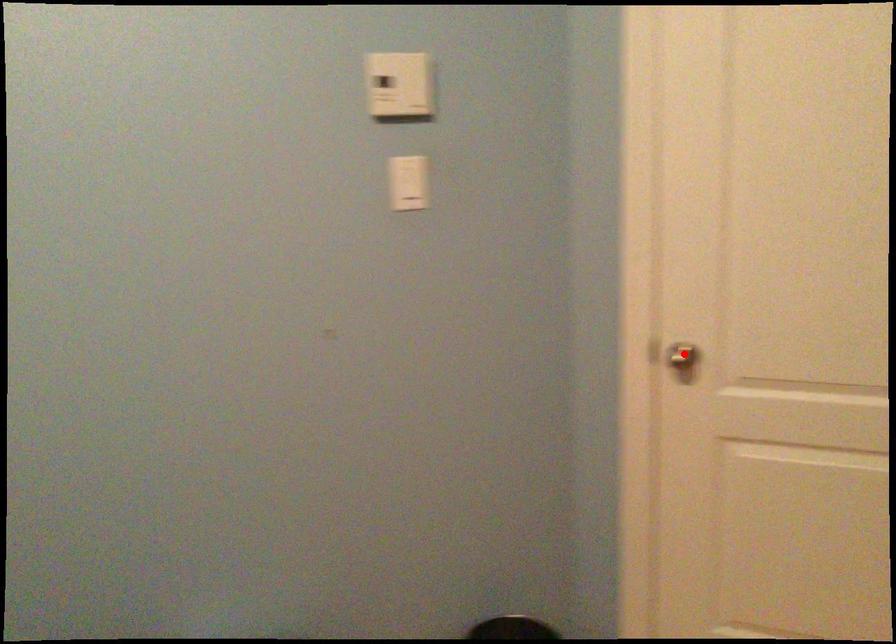
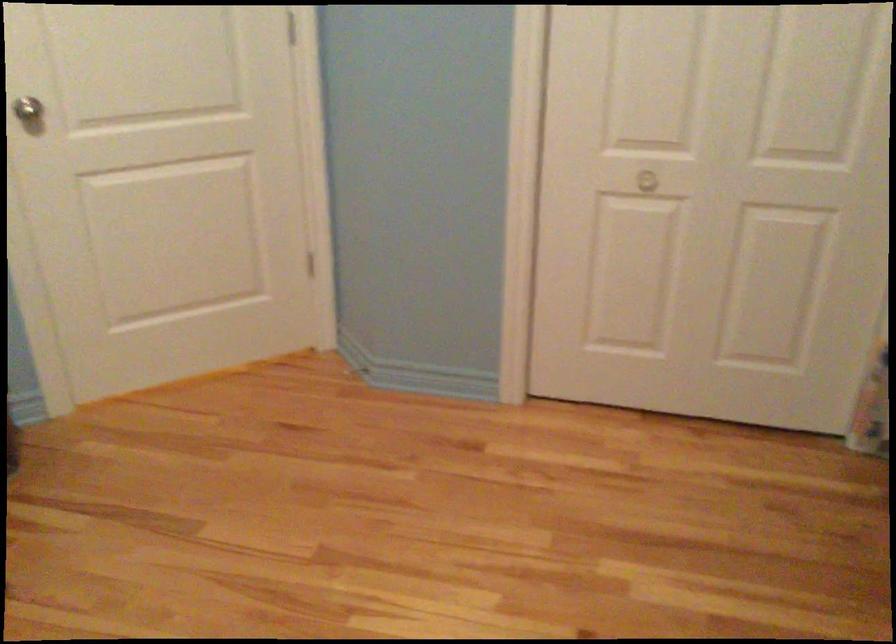
Question: A red point is marked in image1. In image2, is the corresponding 3D point closer to the camera or farther? Reply with the corresponding letter.

Choices:
 (A) The corresponding 3D point is closer.
 (B) The corresponding 3D point is farther.

Answer: (B)